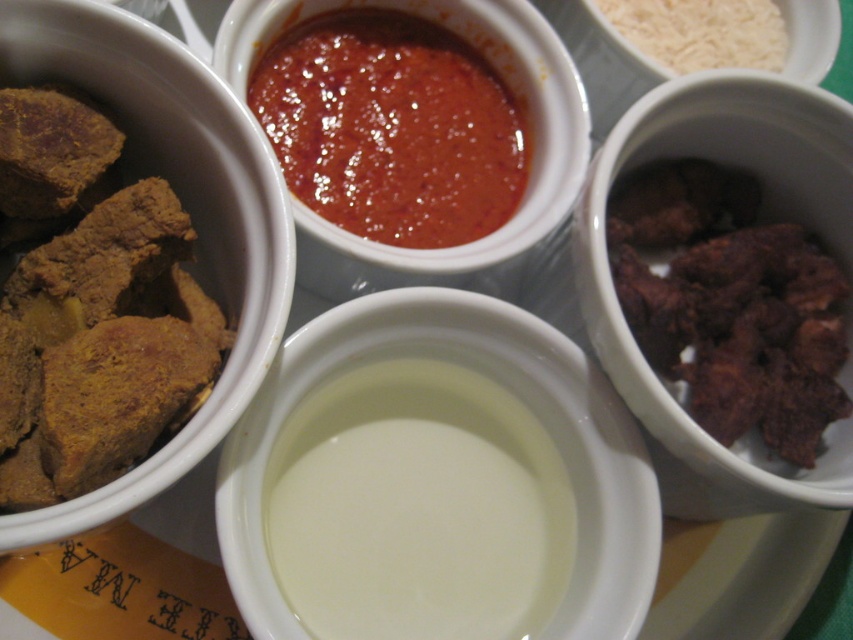
You are a food critic examining the platter. You need to describe the spatial relationship between the shiny red sauce at center top and the white matte rice at upper right. Which one is nearer to you?

The shiny red sauce at center top is closer to the viewer than the white matte rice at upper right.

Looking at the food platter with the white matte rice at upper right and the white rice at upper right, which one is positioned more to the right side of the platter?

The white rice at upper right is positioned more to the right side of the platter because it is to the right of the white matte rice at upper right.